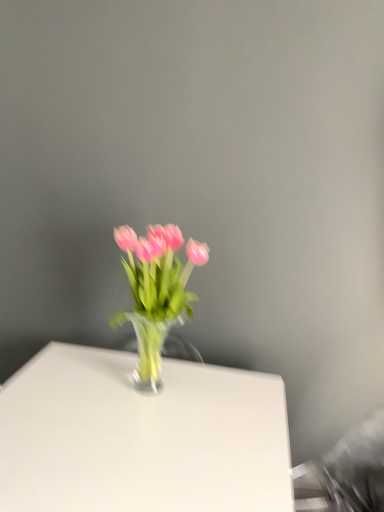
Locate an element on the screen. free space in front of pink glass vase at center is located at coordinates (135, 434).